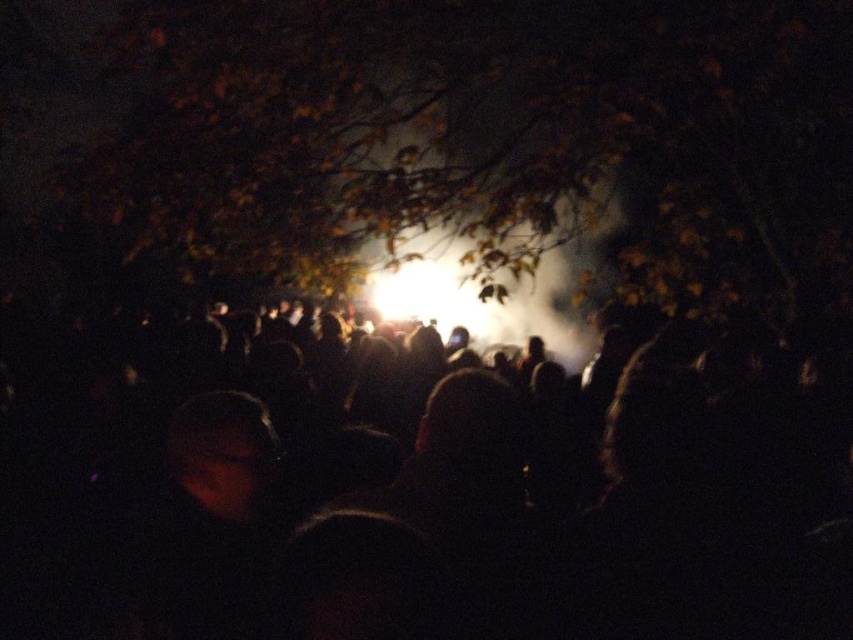
You are a photographer trying to capture the scene with the black matte crowd at center and the brown leafy tree at upper center. Which object is closer to the camera?

The black matte crowd at center is closer to the camera because it is in front of the brown leafy tree at upper center.

Looking at this image, you are standing at the point with coordinates point (419, 490) in the image. What object are you standing on?

You are standing on the black matte crowd at center.